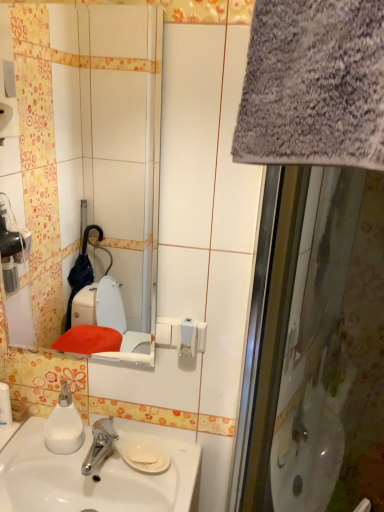
Question: From a real-world perspective, is white matte soap dispenser at lower left located beneath white glossy soap dispenser at lower left?

Choices:
 (A) no
 (B) yes

Answer: (A)

Question: Considering the relative positions of white matte soap dispenser at lower left and white glossy soap dispenser at lower left in the image provided, is white matte soap dispenser at lower left to the left of white glossy soap dispenser at lower left from the viewer's perspective?

Choices:
 (A) no
 (B) yes

Answer: (A)

Question: Are white matte soap dispenser at lower left and white glossy soap dispenser at lower left far apart?

Choices:
 (A) yes
 (B) no

Answer: (B)

Question: Could white glossy soap dispenser at lower left be considered to be inside white matte soap dispenser at lower left?

Choices:
 (A) yes
 (B) no

Answer: (B)

Question: Is white matte soap dispenser at lower left outside white glossy soap dispenser at lower left?

Choices:
 (A) no
 (B) yes

Answer: (B)

Question: Does white matte soap dispenser at lower left have a lesser height compared to white glossy soap dispenser at lower left?

Choices:
 (A) no
 (B) yes

Answer: (A)

Question: From a real-world perspective, is white glossy mirror at upper center located higher than gray fabric screen door at right?

Choices:
 (A) yes
 (B) no

Answer: (A)

Question: Does white glossy mirror at upper center have a greater height compared to gray fabric screen door at right?

Choices:
 (A) no
 (B) yes

Answer: (A)

Question: Is white glossy mirror at upper center positioned beyond the bounds of gray fabric screen door at right?

Choices:
 (A) no
 (B) yes

Answer: (B)

Question: Considering the relative sizes of white glossy mirror at upper center and gray fabric screen door at right in the image provided, is white glossy mirror at upper center shorter than gray fabric screen door at right?

Choices:
 (A) yes
 (B) no

Answer: (A)

Question: Does white glossy mirror at upper center have a larger size compared to gray fabric screen door at right?

Choices:
 (A) yes
 (B) no

Answer: (B)

Question: Does white glossy mirror at upper center have a lesser width compared to gray fabric screen door at right?

Choices:
 (A) yes
 (B) no

Answer: (A)

Question: Can you confirm if gray fabric screen door at right is shorter than white glossy sink at lower left?

Choices:
 (A) no
 (B) yes

Answer: (A)